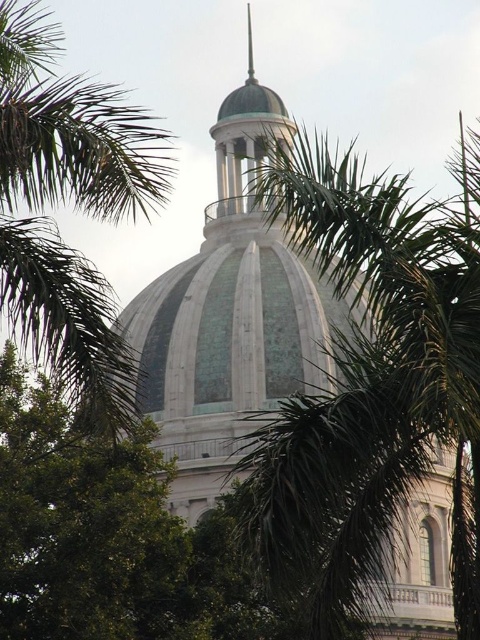
In the scene shown: You are a landscape architect designing a pathway between the two green leafy palm trees mentioned. Given that the minimum required distance between trees for a safe walkway is 10 meters, can you confirm if the existing spacing between the green leafy palm tree at center and the green leafy palm tree at upper center meets this requirement?

→ The distance between the green leafy palm tree at center and the green leafy palm tree at upper center is 11.16 meters, which exceeds the minimum required 10 meters for a safe walkway. Therefore, the existing spacing meets the requirement.